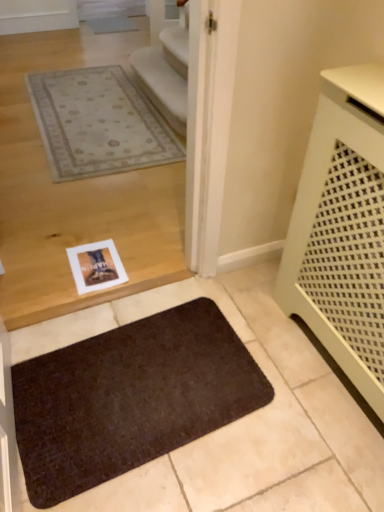
Question: Is point (355, 263) closer or farther from the camera than point (238, 381)?

Choices:
 (A) farther
 (B) closer

Answer: (B)

Question: Considering their positions, is white perforated radiator at right located in front of or behind brown textured mat at lower center?

Choices:
 (A) front
 (B) behind

Answer: (A)

Question: Is white perforated radiator at right taller or shorter than brown textured mat at lower center?

Choices:
 (A) tall
 (B) short

Answer: (A)

Question: Considering the positions of point (41, 361) and point (357, 212), is point (41, 361) closer or farther from the camera than point (357, 212)?

Choices:
 (A) farther
 (B) closer

Answer: (A)

Question: Which is correct: brown textured mat at lower center is inside white perforated radiator at right, or outside of it?

Choices:
 (A) outside
 (B) inside

Answer: (A)

Question: Is brown textured mat at lower center wider or thinner than white perforated radiator at right?

Choices:
 (A) wide
 (B) thin

Answer: (A)

Question: Visually, is brown textured mat at lower center positioned to the left or to the right of white perforated radiator at right?

Choices:
 (A) right
 (B) left

Answer: (B)